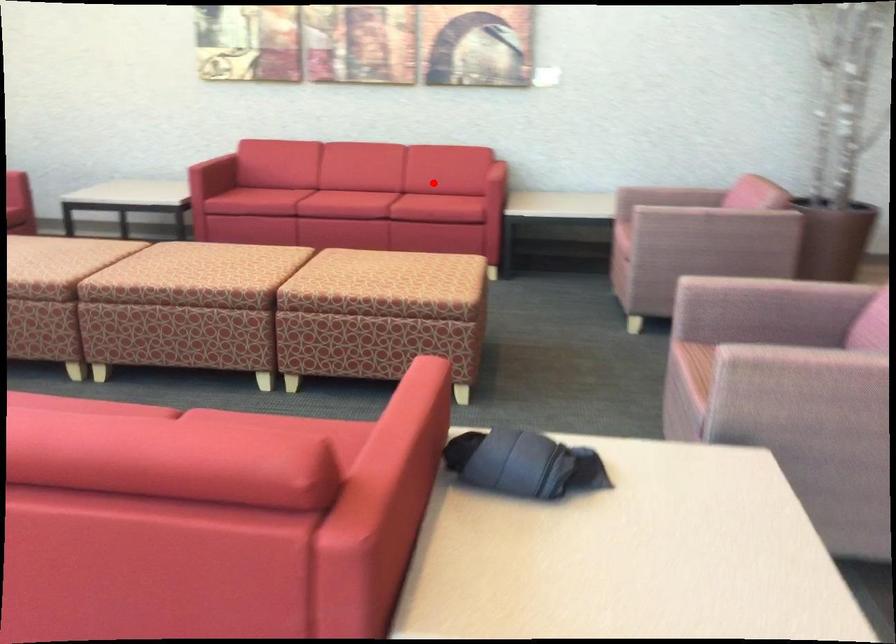
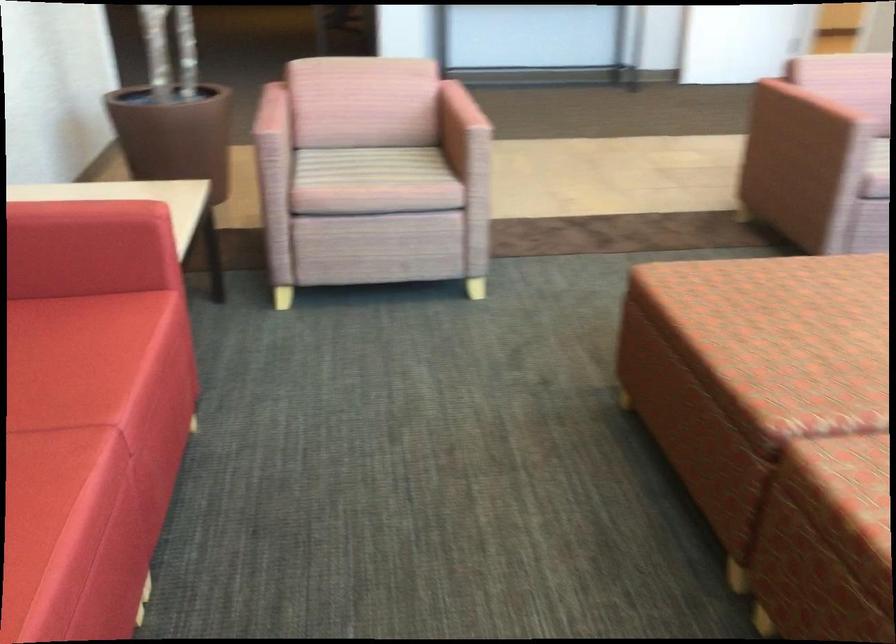
Question: A red point is marked in image1. In image2, is the corresponding 3D point closer to the camera or farther? Reply with the corresponding letter.

Choices:
 (A) The corresponding 3D point is closer.
 (B) The corresponding 3D point is farther.

Answer: (A)